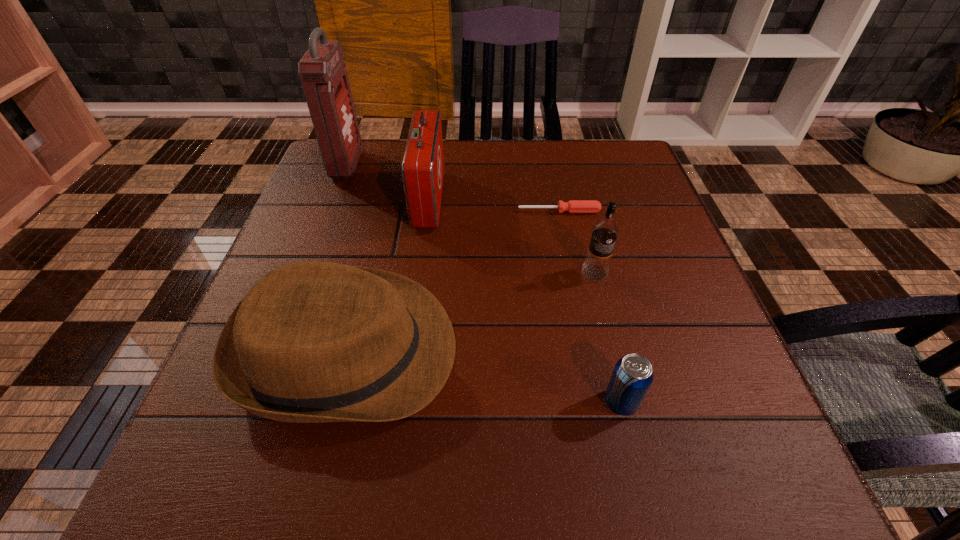
At what (x,y) coordinates should I click in order to perform the action: click on free location that satisfies the following two spatial constraints: 1. on the side of the right first-aid kit with the first aid cross symbol; 2. on the right side of the screwdriver. Please return your answer as a coordinate pair (x, y). The width and height of the screenshot is (960, 540). Looking at the image, I should click on (427, 211).

The image size is (960, 540). I want to click on vacant area in the image that satisfies the following two spatial constraints: 1. on the front-facing side of the fedora; 2. on the back side of the fifth tallest object, so click(x=335, y=402).

At what (x,y) coordinates should I click in order to perform the action: click on vacant area that satisfies the following two spatial constraints: 1. on the front-facing side of the tallest object; 2. on the left side of the fifth tallest object. Please return your answer as a coordinate pair (x, y). This screenshot has height=540, width=960. Looking at the image, I should click on (255, 402).